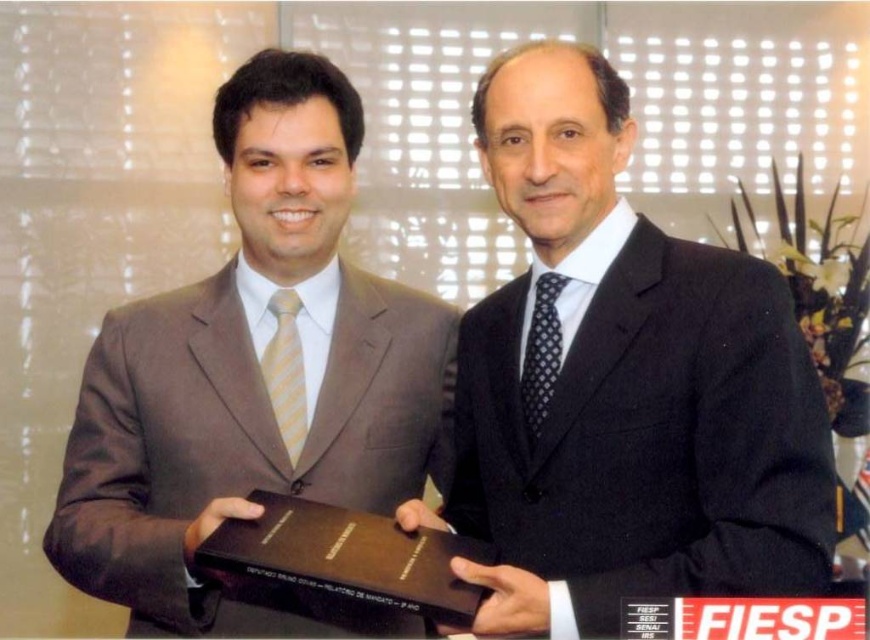
Can you confirm if brown suit at left is taller than brown leather book at center?

Correct, brown suit at left is much taller as brown leather book at center.

Is brown suit at left further to the viewer compared to brown leather book at center?

Yes, it is behind brown leather book at center.

Find the location of a particular element. brown suit at left is located at coordinates (255, 384).

This screenshot has height=640, width=870. I want to click on brown suit at left, so 255,384.

Who is taller, black matte suit at center or brown suit at left?

brown suit at left

Is point (797, 355) positioned in front of point (353, 116)?

Yes.

Image resolution: width=870 pixels, height=640 pixels. I want to click on black matte suit at center, so click(621, 385).

Between black matte suit at center and brown leather book at center, which one is positioned lower?

brown leather book at center is lower down.

The width and height of the screenshot is (870, 640). In order to click on black matte suit at center in this screenshot , I will do `click(621, 385)`.

The image size is (870, 640). I want to click on black matte suit at center, so click(621, 385).